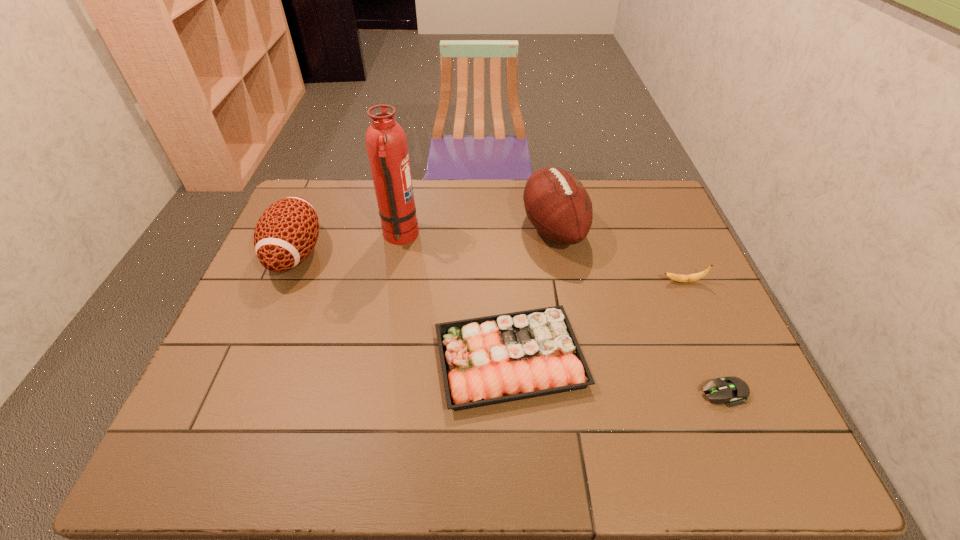
The height and width of the screenshot is (540, 960). Find the location of `object that is the fifth closest to the leftmost object`. object that is the fifth closest to the leftmost object is located at coordinates (733, 390).

Image resolution: width=960 pixels, height=540 pixels. In order to click on free space that satisfies the following two spatial constraints: 1. on the front side of the fifth tallest object; 2. on the right side of the left football in this screenshot , I will do `click(252, 359)`.

This screenshot has width=960, height=540. In order to click on free spot that satisfies the following two spatial constraints: 1. on the label side of the fifth tallest object; 2. on the right side of the fifth object from right to left in this screenshot , I will do tap(377, 359).

This screenshot has width=960, height=540. I want to click on vacant area in the image that satisfies the following two spatial constraints: 1. on the front side of the shortest object; 2. on the right side of the platter, so click(512, 392).

I want to click on free space in the image that satisfies the following two spatial constraints: 1. on the label side of the second object from left to right; 2. on the right side of the fifth tallest object, so click(377, 359).